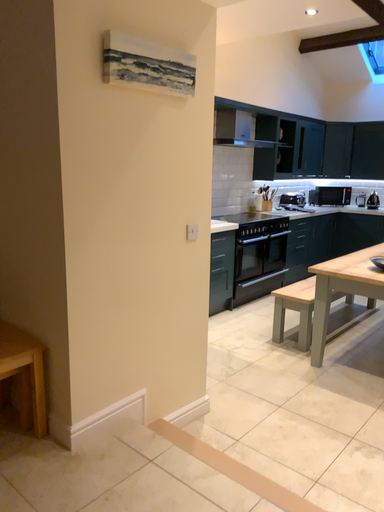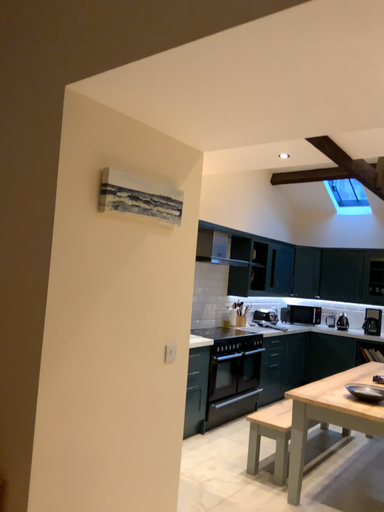
Question: How did the camera likely rotate when shooting the video?

Choices:
 (A) rotated downward
 (B) rotated upward

Answer: (B)